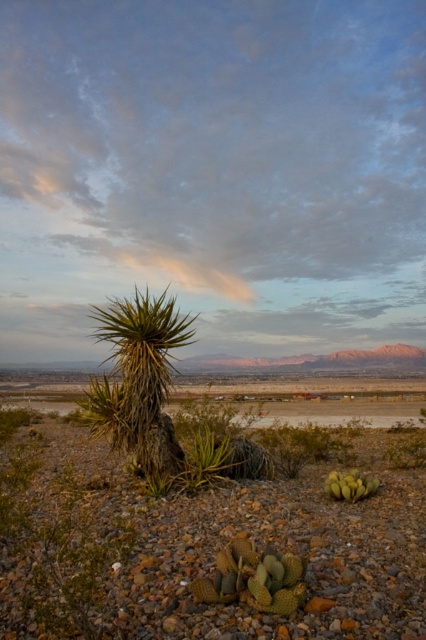
Between green spiky plant at center and green spiky cactus at lower right, which one has more height?

green spiky plant at center

The width and height of the screenshot is (426, 640). Find the location of `green spiky plant at center`. green spiky plant at center is located at coordinates (204, 461).

Between point (238, 563) and point (342, 497), which one is positioned behind?

The point (342, 497) is more distant.

Does green spiky cactus at lower center appear on the right side of green spiky cactus at lower right?

In fact, green spiky cactus at lower center is to the left of green spiky cactus at lower right.

What are the coordinates of `green spiky cactus at lower center` in the screenshot? It's located at (253, 579).

Where is `green spiky cactus at lower center`? This screenshot has height=640, width=426. green spiky cactus at lower center is located at coordinates (253, 579).

Who is taller, green spiky cactus at lower center or green spiky plant at center?

With more height is green spiky plant at center.

How much distance is there between green spiky cactus at lower center and green spiky plant at center?

The distance of green spiky cactus at lower center from green spiky plant at center is 8.57 feet.

Is point (279, 611) in front of point (178, 484)?

Yes.

Where is `green spiky cactus at lower center`? Image resolution: width=426 pixels, height=640 pixels. green spiky cactus at lower center is located at coordinates (253, 579).